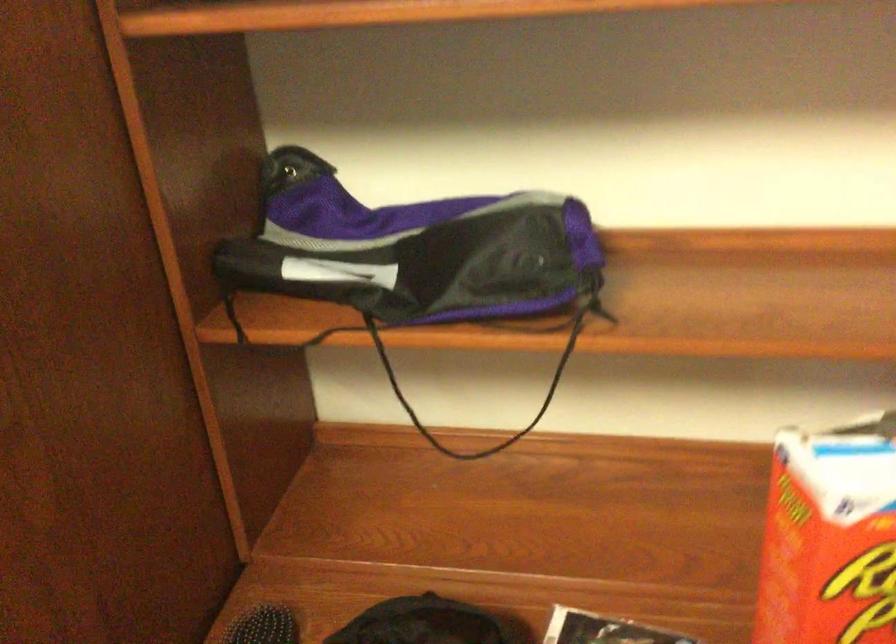
Describe the element at coordinates (830, 538) in the screenshot. This screenshot has height=644, width=896. I see `the red cereal box` at that location.